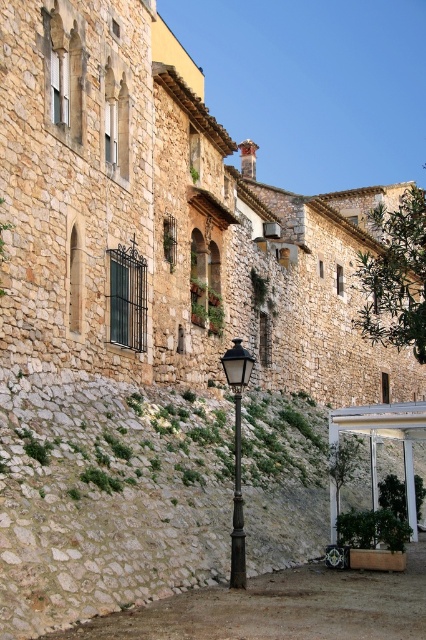
You are a delivery person with a cart that is 2 meters wide. You need to move your cart from the streetlamp to the wall. Is there enough space between the polished bronze streetlamp at center and the rustic stone wall at center for your cart to pass through?

The distance between the polished bronze streetlamp at center and the rustic stone wall at center is 4.93 meters, which is more than enough for a 2 meter wide cart to pass through.

You are a tourist standing on the cobblestone path and want to take a photo of the rustic stone wall at center and the polished bronze streetlamp at center. Which object is closer to the camera? Please explain your reasoning based on their positions.

The rustic stone wall at center is positioned under the polished bronze streetlamp at center, so the streetlamp is closer to the camera. Since the wall is underneath the lamp, it means the lamp is above and therefore nearer to the observer standing on the path.